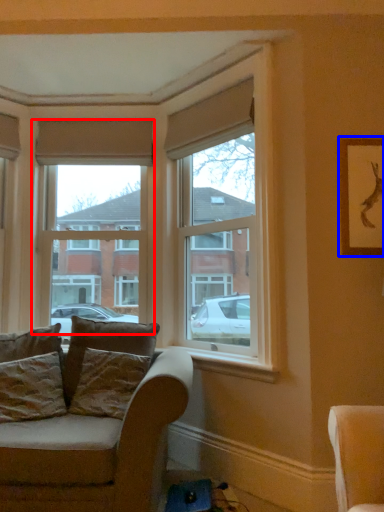
Question: Which object appears farthest to the camera in this image, window (highlighted by a red box) or picture frame (highlighted by a blue box)?

Choices:
 (A) window
 (B) picture frame

Answer: (A)